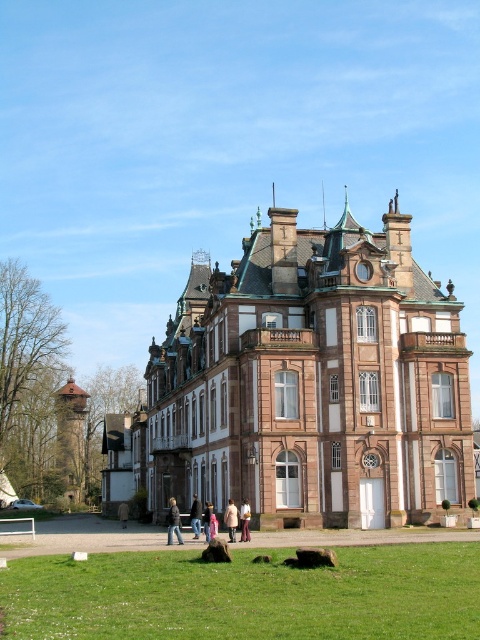
Does pink stone palace at center have a larger size compared to dark blue leather jacket at center?

Correct, pink stone palace at center is larger in size than dark blue leather jacket at center.

Is pink stone palace at center to the right of dark blue leather jacket at center from the viewer's perspective?

Indeed, pink stone palace at center is positioned on the right side of dark blue leather jacket at center.

You are a GUI agent. You are given a task and a screenshot of the screen. Output one action in this format:
    pyautogui.click(x=<x>, y=<y>)
    Task: Click on the pink stone palace at center
    
    Given the screenshot: What is the action you would take?
    pyautogui.click(x=311, y=381)

What do you see at coordinates (173, 522) in the screenshot?
I see `dark blue leather jacket at center` at bounding box center [173, 522].

Which is in front, point (170, 540) or point (190, 522)?

Point (170, 540) is more forward.

This screenshot has width=480, height=640. In order to click on dark blue leather jacket at center in this screenshot , I will do `click(173, 522)`.

Is green grass at lower center taller than light brown fabric pants at center?

Yes.

Is point (275, 579) farther from camera compared to point (248, 513)?

No, it is not.

Locate an element on the screen. green grass at lower center is located at coordinates (247, 595).

At what (x,y) coordinates should I click in order to perform the action: click on green grass at lower center. Please return your answer as a coordinate pair (x, y). Looking at the image, I should click on (247, 595).